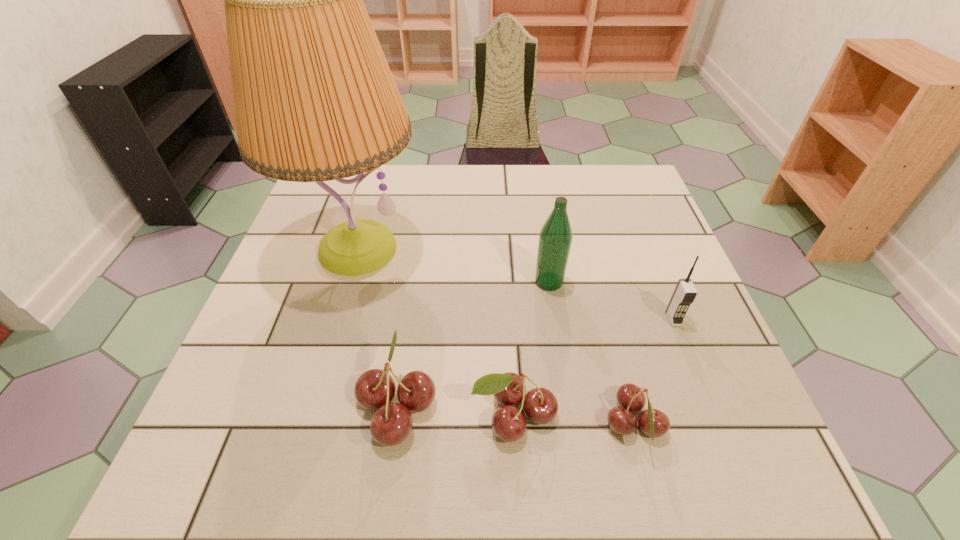
This screenshot has height=540, width=960. I want to click on vacant point located between the third farthest object and the second cherry from right to left, so click(593, 367).

Find the location of a particular element. This screenshot has width=960, height=540. free space between the lamp and the fifth shortest object is located at coordinates (453, 266).

At what (x,y) coordinates should I click in order to perform the action: click on empty space that is in between the third tallest object and the tallest object. Please return your answer as a coordinate pair (x, y). This screenshot has width=960, height=540. Looking at the image, I should click on (516, 284).

Where is `free space between the bottle and the cellular telephone`? Image resolution: width=960 pixels, height=540 pixels. free space between the bottle and the cellular telephone is located at coordinates (612, 300).

At what (x,y) coordinates should I click in order to perform the action: click on empty location between the leftmost cherry and the cellular telephone. Please return your answer as a coordinate pair (x, y). This screenshot has height=540, width=960. Looking at the image, I should click on (535, 362).

Locate an element on the screen. The image size is (960, 540). vacant region between the leftmost cherry and the tallest object is located at coordinates (377, 327).

Where is `vacant area that lies between the second shortest cherry and the rightmost object`? vacant area that lies between the second shortest cherry and the rightmost object is located at coordinates (593, 367).

Locate an element on the screen. The image size is (960, 540). object that ranks as the third closest to the leftmost cherry is located at coordinates (555, 238).

Select which object appears as the third closest to the second cherry from left to right. Please provide its 2D coordinates. Your answer should be formatted as a tuple, i.e. [(x, y)], where the tuple contains the x and y coordinates of a point satisfying the conditions above.

[(555, 238)]

Identify which cherry is the second nearest to the second tallest object. Please provide its 2D coordinates. Your answer should be formatted as a tuple, i.e. [(x, y)], where the tuple contains the x and y coordinates of a point satisfying the conditions above.

[(654, 423)]